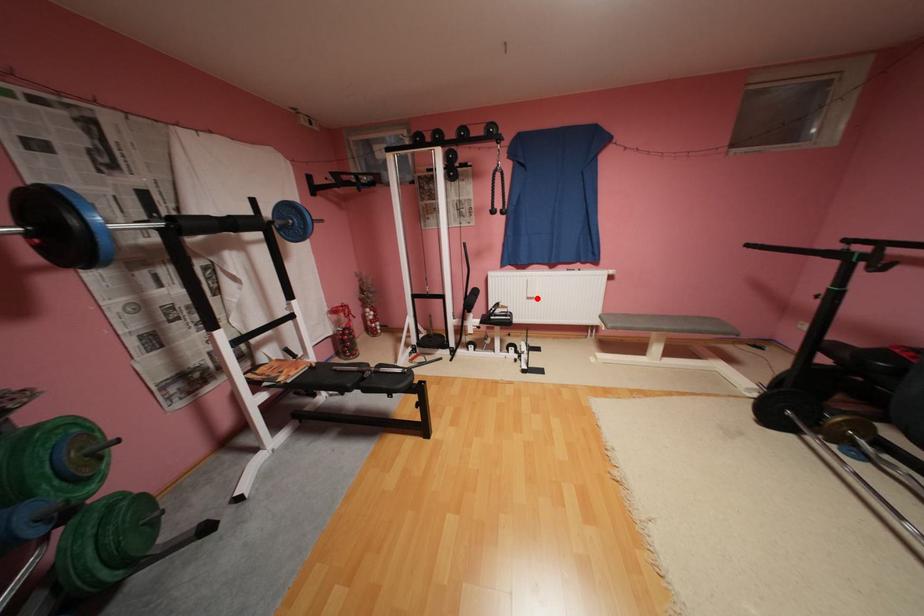
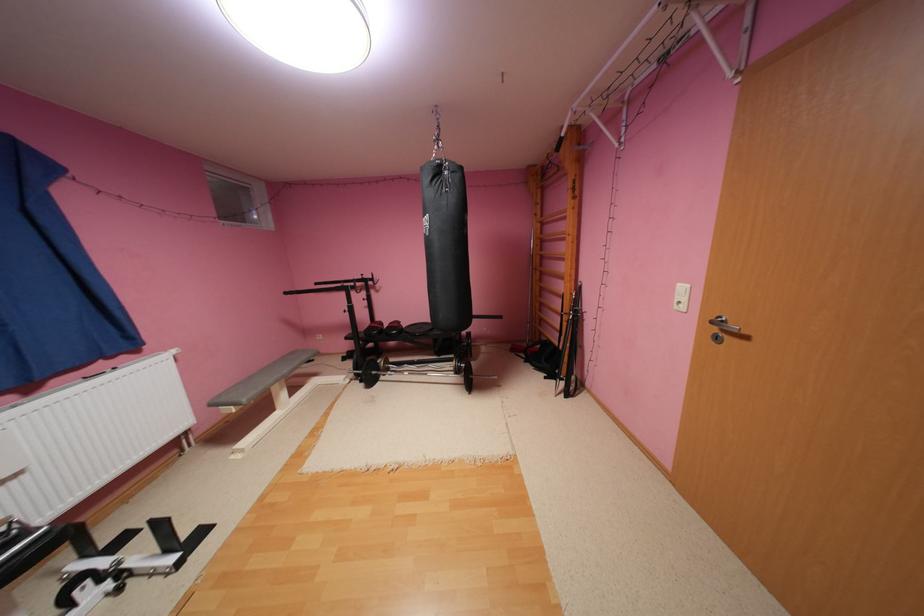
In the second image, find the point that corresponds to the highlighted location in the first image.

(11, 483)